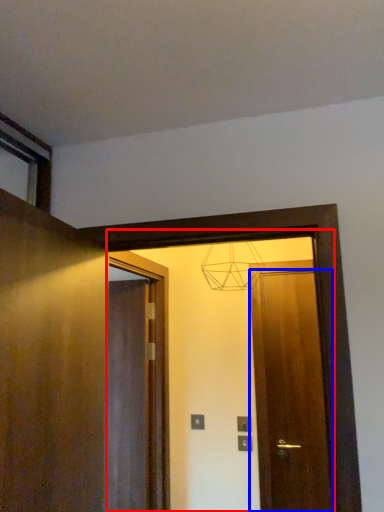
Question: Which object is closer to the camera taking this photo, mirror (highlighted by a red box) or door (highlighted by a blue box)?

Choices:
 (A) mirror
 (B) door

Answer: (A)